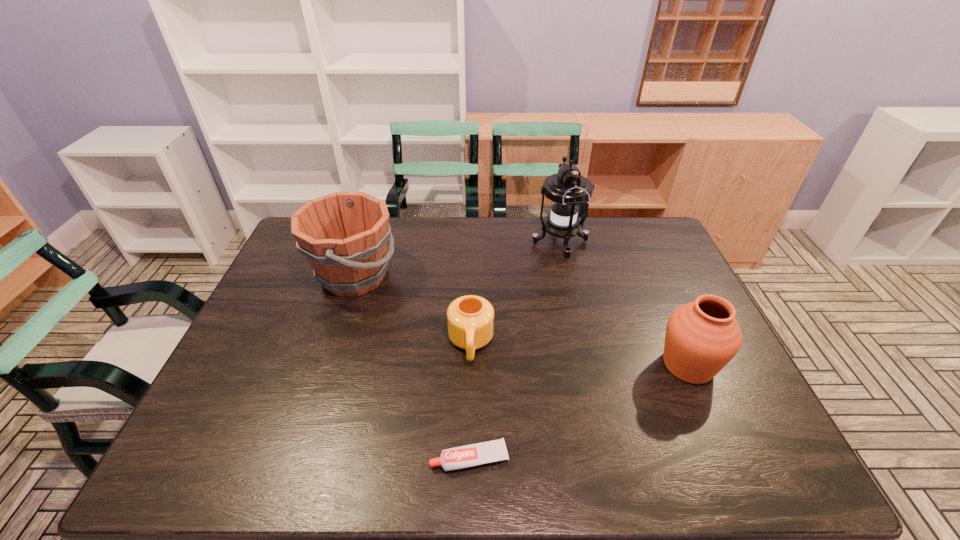
I want to click on blank space that satisfies the following two spatial constraints: 1. on the handle side of the nearest object; 2. on the left side of the leftmost object, so click(x=295, y=458).